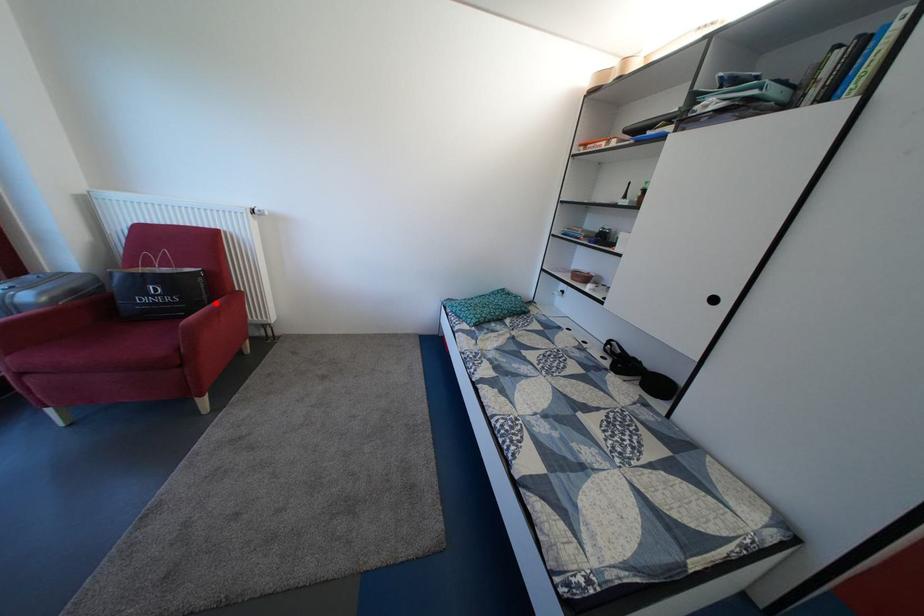
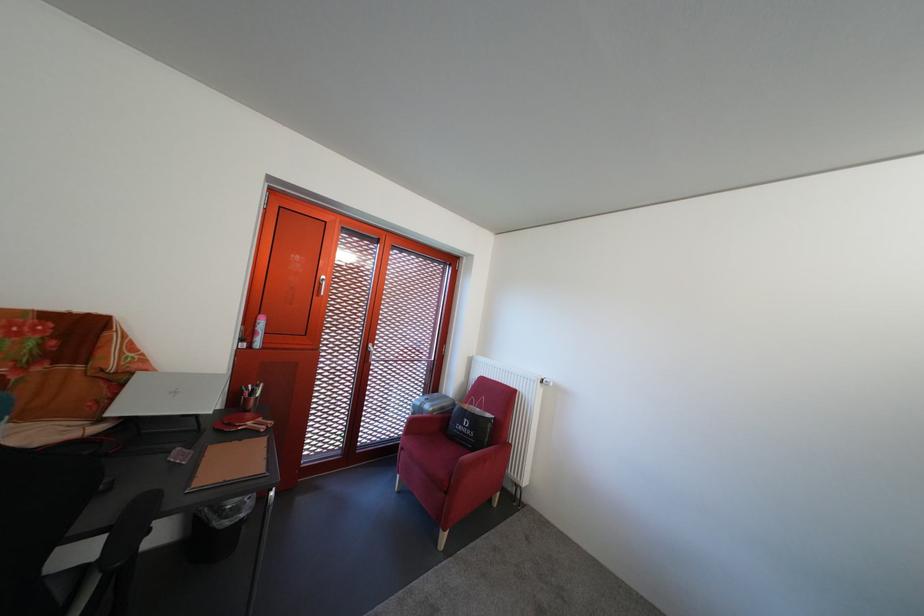
Where in the second image is the point corresponding to the highlighted location from the first image?

(497, 446)